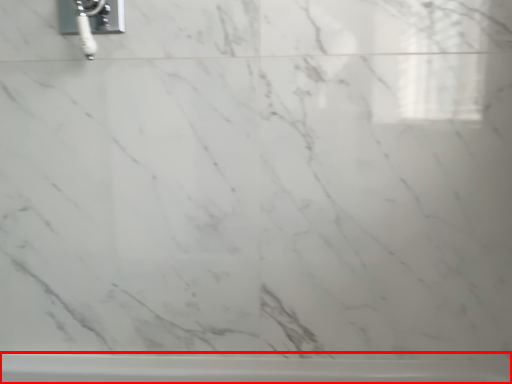
Question: In this image, where is bathtub (annotated by the red box) located relative to plumbing fixture?

Choices:
 (A) left
 (B) right

Answer: (B)